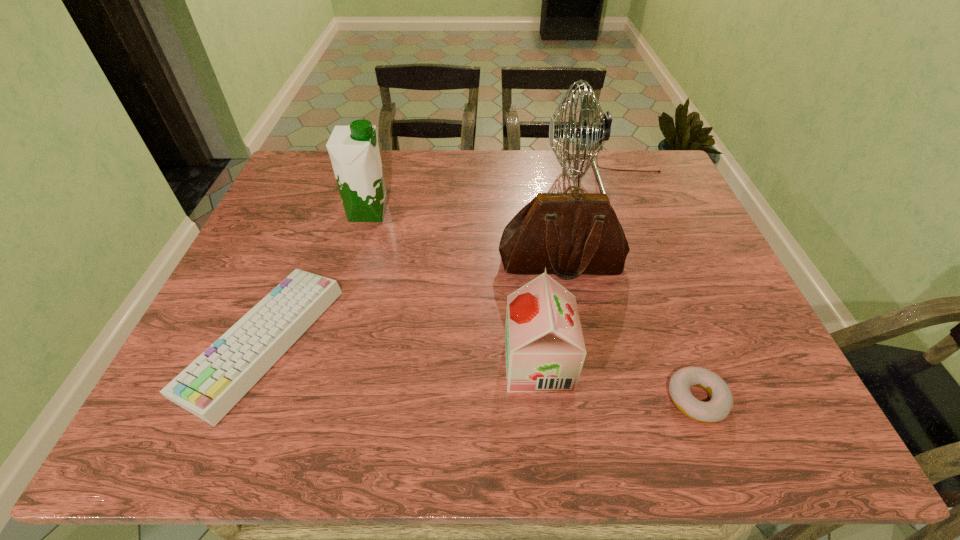
Locate an element on the screen. The width and height of the screenshot is (960, 540). vacant space situated 0.140m on the front-facing side of the fan is located at coordinates pos(500,178).

This screenshot has height=540, width=960. I want to click on vacant space located on the front-facing side of the farther soya milk, so click(x=475, y=212).

The height and width of the screenshot is (540, 960). Identify the location of blank area located on the back of the shoulder bag. (546, 181).

This screenshot has width=960, height=540. I want to click on free space located 0.120m with the cap open on the right soya milk, so click(x=446, y=363).

At what (x,y) coordinates should I click in order to perform the action: click on blank space located 0.220m with the cap open on the right soya milk. Please return your answer as a coordinate pair (x, y). The image size is (960, 540). Looking at the image, I should click on [x=397, y=363].

This screenshot has width=960, height=540. What are the coordinates of `vacant space positioned with the cap open on the right soya milk` in the screenshot? It's located at (407, 363).

Image resolution: width=960 pixels, height=540 pixels. Identify the location of vacant space located 0.350m on the right of the fifth tallest object. (494, 341).

I want to click on free space located on the left of the shortest object, so click(552, 399).

Find the location of a particular element. The height and width of the screenshot is (540, 960). object located at the far edge is located at coordinates (600, 131).

Find the location of a particular element. The width and height of the screenshot is (960, 540). computer keyboard at the near edge is located at coordinates (214, 382).